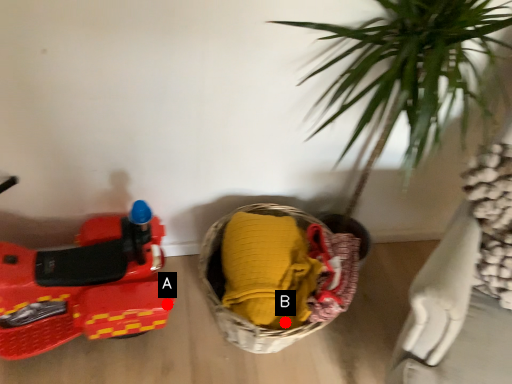
Question: Two points are circled on the image, labeled by A and B beside each circle. Which point appears closest to the camera in this image?

Choices:
 (A) A is closer
 (B) B is closer

Answer: (B)